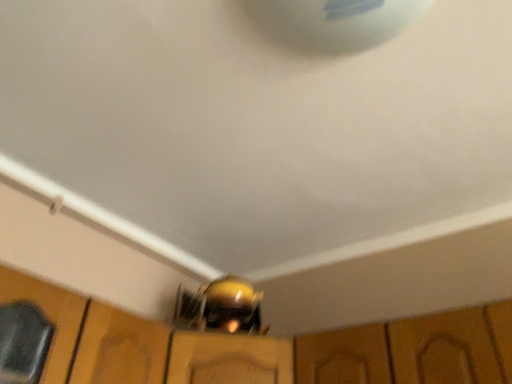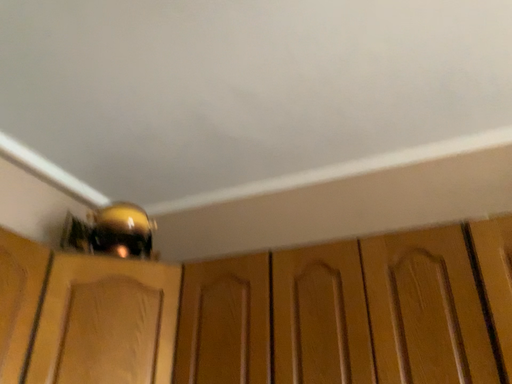
Question: How did the camera likely rotate when shooting the video?

Choices:
 (A) rotated upward
 (B) rotated downward

Answer: (B)